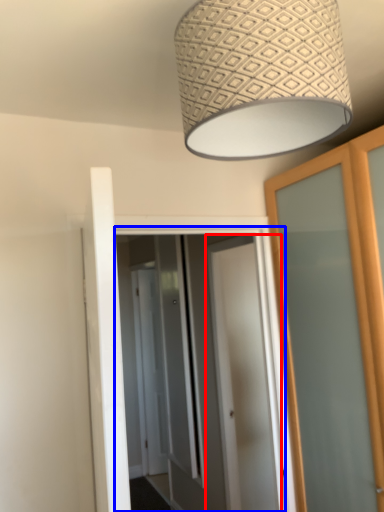
Question: Which of the following is the farthest to the observer, door (highlighted by a red box) or screen door (highlighted by a blue box)?

Choices:
 (A) door
 (B) screen door

Answer: (A)